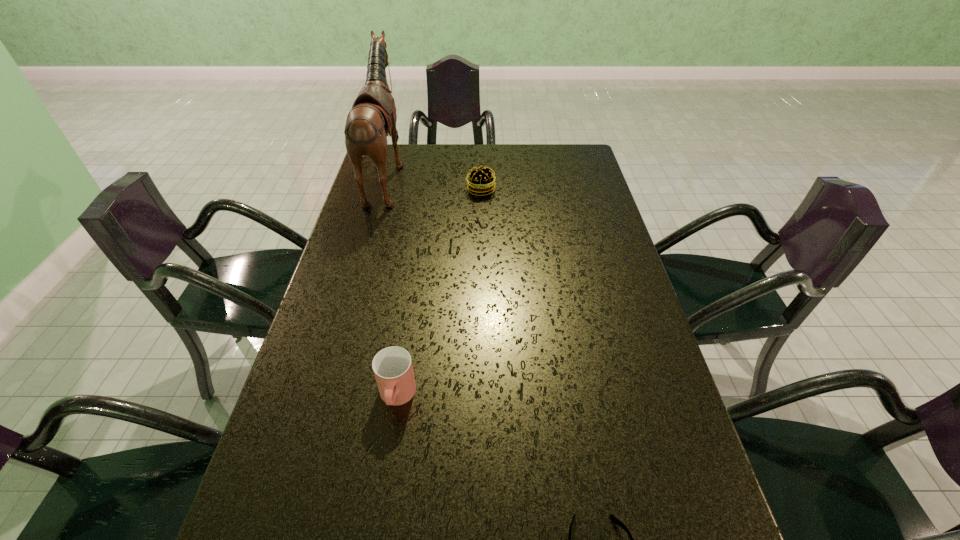
Where is `free space between the third object from left to right and the tallest object`? The image size is (960, 540). free space between the third object from left to right and the tallest object is located at coordinates (434, 183).

You are a GUI agent. You are given a task and a screenshot of the screen. Output one action in this format:
    pyautogui.click(x=<x>, y=<y>)
    Task: Click on the free space between the leftmost object and the second object from left to right
    
    Given the screenshot: What is the action you would take?
    pyautogui.click(x=392, y=286)

Locate which object is the third closest to the nearest object. Please provide its 2D coordinates. Your answer should be formatted as a tuple, i.e. [(x, y)], where the tuple contains the x and y coordinates of a point satisfying the conditions above.

[(480, 181)]

Image resolution: width=960 pixels, height=540 pixels. I want to click on object that is the second closest to the tallest object, so click(x=392, y=366).

What are the coordinates of `free spot that satisfies the following two spatial constraints: 1. on the back of the saddle; 2. on the right side of the second shortest object` in the screenshot? It's located at (383, 190).

At what (x,y) coordinates should I click in order to perform the action: click on vacant area in the image that satisfies the following two spatial constraints: 1. on the back of the tallest object; 2. on the left side of the patty. Please return your answer as a coordinate pair (x, y). This screenshot has height=540, width=960. Looking at the image, I should click on (383, 190).

You are a GUI agent. You are given a task and a screenshot of the screen. Output one action in this format:
    pyautogui.click(x=<x>, y=<y>)
    Task: Click on the vacant area that satisfies the following two spatial constraints: 1. on the back of the saddle; 2. on the back side of the second shortest object
    
    Given the screenshot: What is the action you would take?
    pyautogui.click(x=383, y=190)

At what (x,y) coordinates should I click in order to perform the action: click on vacant point that satisfies the following two spatial constraints: 1. on the back of the tallest object; 2. on the back side of the third object from left to right. Please return your answer as a coordinate pair (x, y). Looking at the image, I should click on (383, 190).

Locate an element on the screen. The width and height of the screenshot is (960, 540). vacant space that satisfies the following two spatial constraints: 1. on the back side of the third object from left to right; 2. on the back of the tallest object is located at coordinates (481, 176).